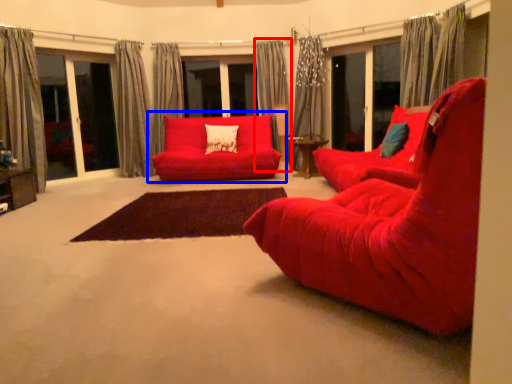
Question: Which object appears closest to the camera in this image, curtain (highlighted by a red box) or studio couch (highlighted by a blue box)?

Choices:
 (A) curtain
 (B) studio couch

Answer: (B)